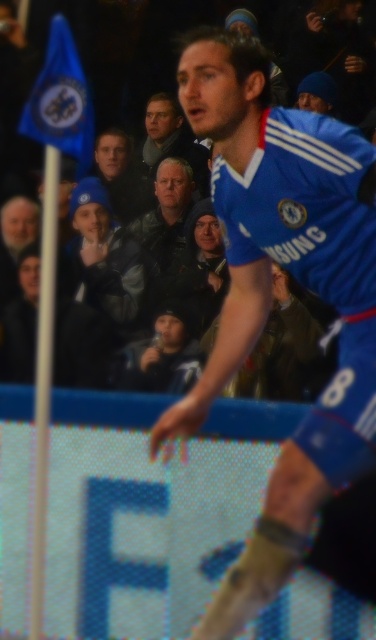
Between blue jersey at center and dark blue jacket at center, which one appears on the right side from the viewer's perspective?

From the viewer's perspective, blue jersey at center appears more on the right side.

Can you confirm if blue jersey at center is positioned to the right of dark blue jacket at center?

Yes, blue jersey at center is to the right of dark blue jacket at center.

Which is in front, point (280, 173) or point (183, 124)?

Positioned in front is point (280, 173).

Locate an element on the screen. The image size is (376, 640). blue jersey at center is located at coordinates (271, 292).